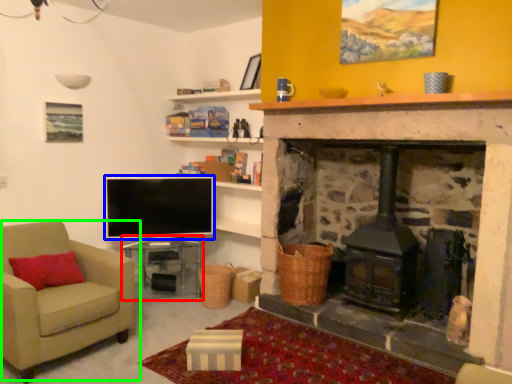
Question: Which object is the farthest from table (highlighted by a red box)? Choose among these: television (highlighted by a blue box) or chair (highlighted by a green box).

Choices:
 (A) television
 (B) chair

Answer: (B)